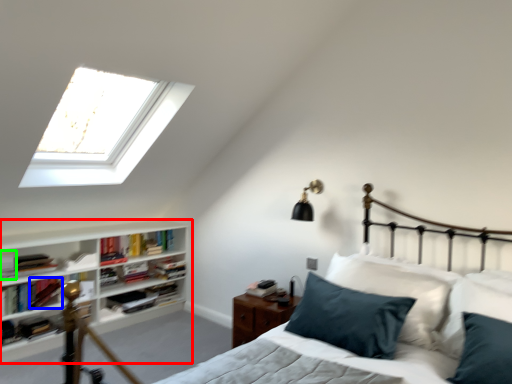
Question: Considering the real-world distances, which object is closest to shelf (highlighted by a red box)? book (highlighted by a blue box) or book (highlighted by a green box).

Choices:
 (A) book
 (B) book

Answer: (A)